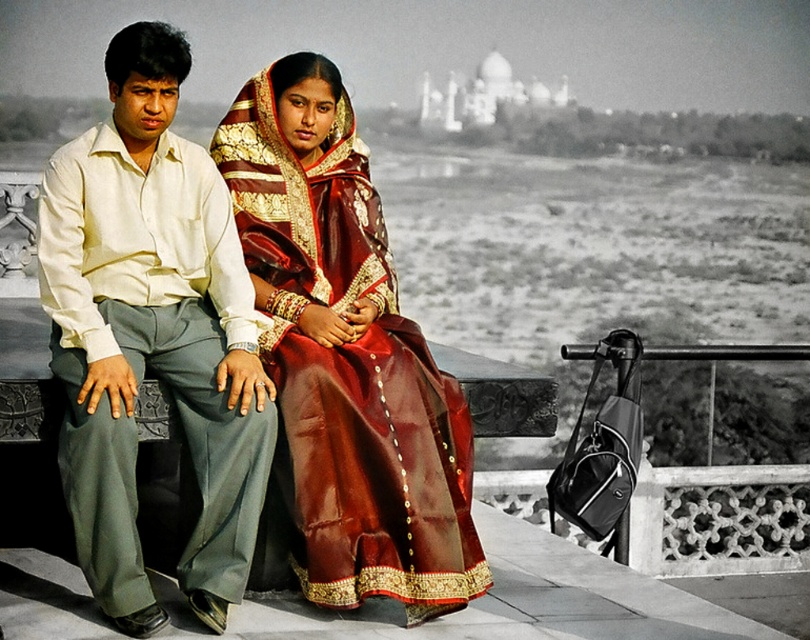
Does light beige cotton shirt at left appear over shiny silk saree at center?

Yes, light beige cotton shirt at left is above shiny silk saree at center.

Locate an element on the screen. This screenshot has width=810, height=640. light beige cotton shirt at left is located at coordinates (152, 336).

I want to click on light beige cotton shirt at left, so click(152, 336).